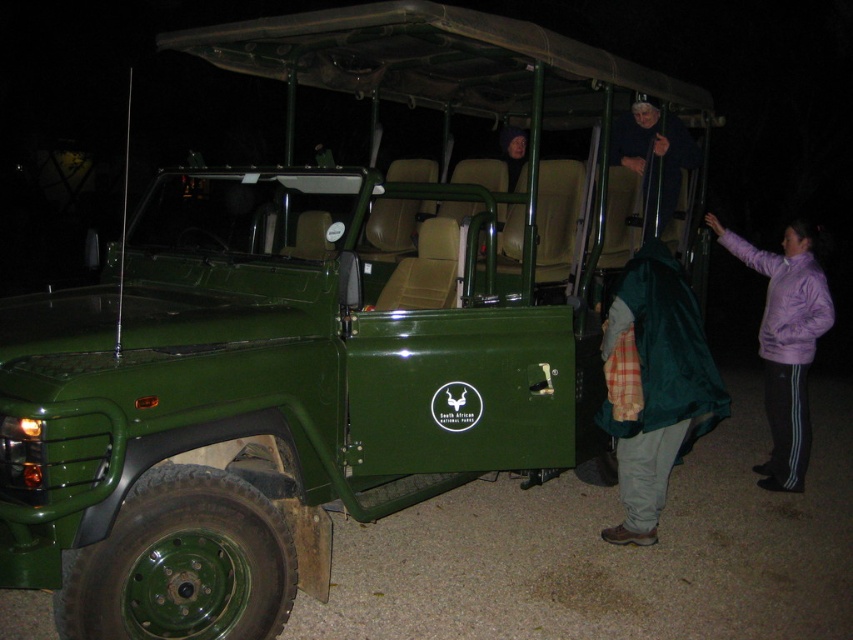
Question: Is purple fleece jacket at right thinner than dark blue sweater at upper center?

Choices:
 (A) no
 (B) yes

Answer: (A)

Question: Does purple fleece jacket at right appear under dark blue sweater at upper center?

Choices:
 (A) yes
 (B) no

Answer: (A)

Question: Which point is farther to the camera?

Choices:
 (A) dark blue sweater at upper center
 (B) purple fleece jacket at right

Answer: (A)

Question: Does purple fleece jacket at right have a smaller size compared to dark blue sweater at upper center?

Choices:
 (A) no
 (B) yes

Answer: (A)